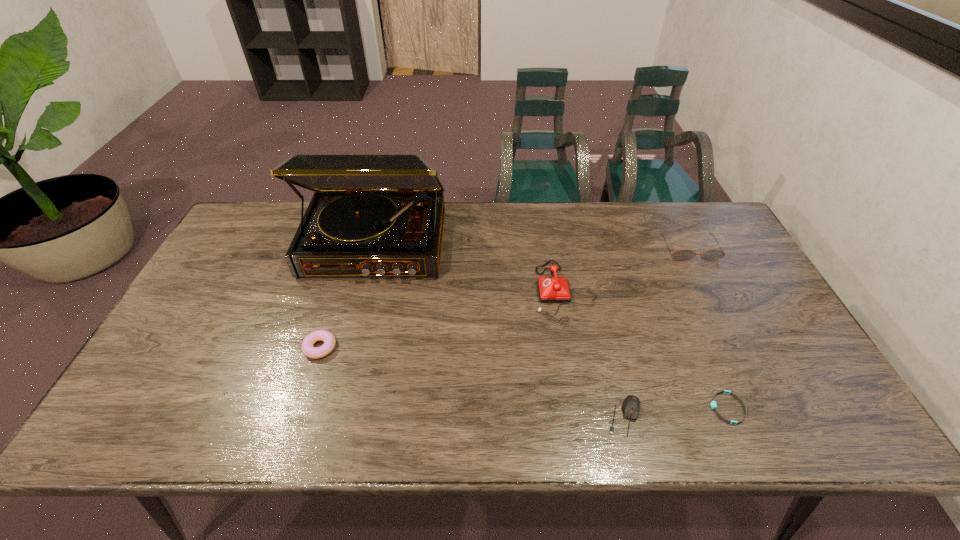
Where is `free spot between the doughnut and the mouse`? The image size is (960, 540). free spot between the doughnut and the mouse is located at coordinates (472, 382).

Find the location of a particular element. The image size is (960, 540). unoccupied area between the third shortest object and the telephone is located at coordinates (443, 319).

Where is `vacant space in between the tallest object and the doughnut`? The width and height of the screenshot is (960, 540). vacant space in between the tallest object and the doughnut is located at coordinates 348,295.

I want to click on vacant space that's between the second shortest object and the second tallest object, so point(594,354).

Identify the location of free space between the doughnut and the record player. This screenshot has height=540, width=960. (348, 295).

Where is `free space between the third nearest object and the record player`? free space between the third nearest object and the record player is located at coordinates (348, 295).

This screenshot has width=960, height=540. I want to click on vacant area that lies between the fifth shortest object and the record player, so click(x=470, y=268).

Identify the location of vacant area that lies between the tallest object and the shortest object. Image resolution: width=960 pixels, height=540 pixels. (552, 326).

Locate an element on the screen. This screenshot has width=960, height=540. vacant area that lies between the mouse and the wristband is located at coordinates (676, 412).

You are a GUI agent. You are given a task and a screenshot of the screen. Output one action in this format:
    pyautogui.click(x=<x>, y=<y>)
    Task: Click on the empty location between the doughnut and the wristband
    
    Given the screenshot: What is the action you would take?
    point(524,377)